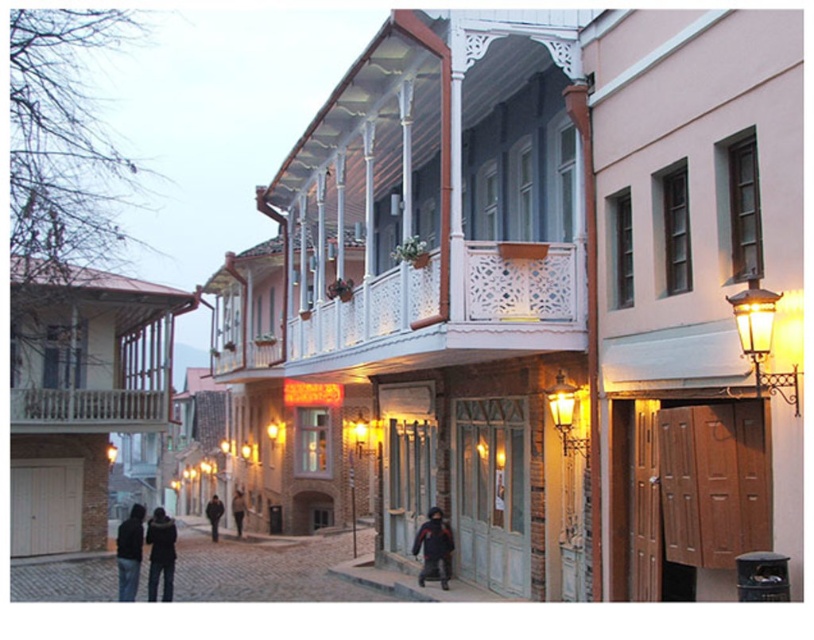
Does white carved wood balcony at center come in front of wooden balcony at center?

Yes, white carved wood balcony at center is closer to the viewer.

Which is above, white carved wood balcony at center or wooden balcony at center?

white carved wood balcony at center is higher up.

Find the location of a particular element. This screenshot has width=814, height=640. white carved wood balcony at center is located at coordinates (444, 320).

Can you confirm if cobblestone street at lower left is shorter than golden wrought iron streetlamp at right?

No.

Measure the distance from cobblestone street at lower left to golden wrought iron streetlamp at right.

A distance of 13.27 meters exists between cobblestone street at lower left and golden wrought iron streetlamp at right.

Is point (335, 552) positioned after point (742, 355)?

That is True.

Find the location of a particular element. The width and height of the screenshot is (814, 640). cobblestone street at lower left is located at coordinates (265, 570).

Does golden brass streetlamp at right appear over dark blue jacket at lower center?

Indeed, golden brass streetlamp at right is positioned over dark blue jacket at lower center.

What are the coordinates of `golden brass streetlamp at right` in the screenshot? It's located at (567, 416).